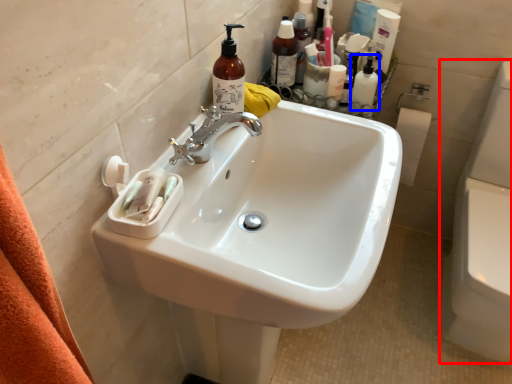
Question: Which point is further to the camera, toilet bowl (highlighted by a red box) or toiletry (highlighted by a blue box)?

Choices:
 (A) toilet bowl
 (B) toiletry

Answer: (B)